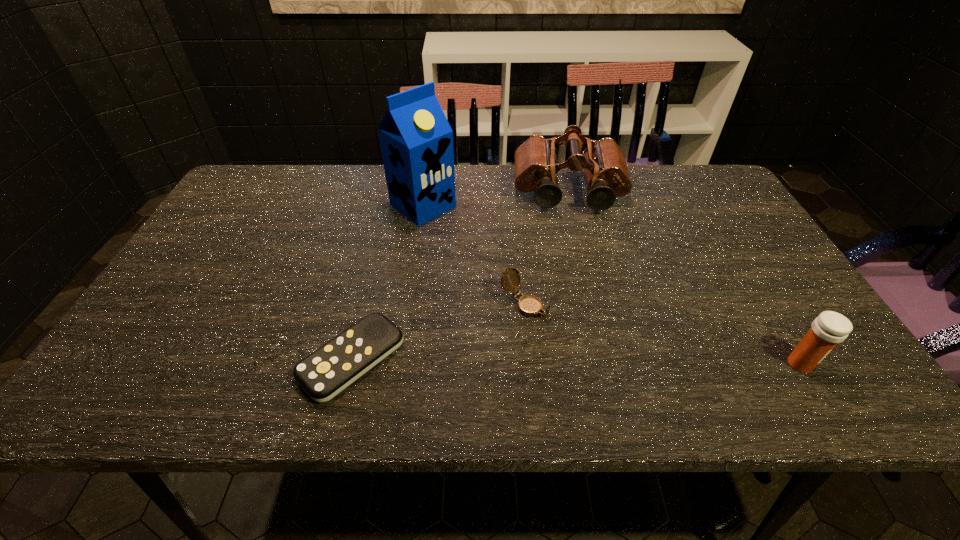
The width and height of the screenshot is (960, 540). I want to click on remote control, so click(326, 372).

I want to click on the rightmost object, so click(827, 330).

Where is `medicine`? medicine is located at coordinates (x=827, y=330).

I want to click on the fourth tallest object, so click(529, 305).

At what (x,y) coordinates should I click in order to perform the action: click on the second tallest object. Please return your answer as a coordinate pair (x, y). This screenshot has height=540, width=960. Looking at the image, I should click on (603, 161).

The image size is (960, 540). What are the coordinates of `carton` in the screenshot? It's located at (416, 140).

Locate an element on the screen. The image size is (960, 540). free space located 0.050m on the back of the remote control is located at coordinates (366, 303).

Find the location of `vacant space located 0.060m on the label side of the medicine`. vacant space located 0.060m on the label side of the medicine is located at coordinates (843, 364).

Identify the location of free point located 0.150m on the face of the fourth tallest object. This screenshot has height=540, width=960. (600, 354).

The image size is (960, 540). I want to click on free region located on the face of the fourth tallest object, so click(592, 349).